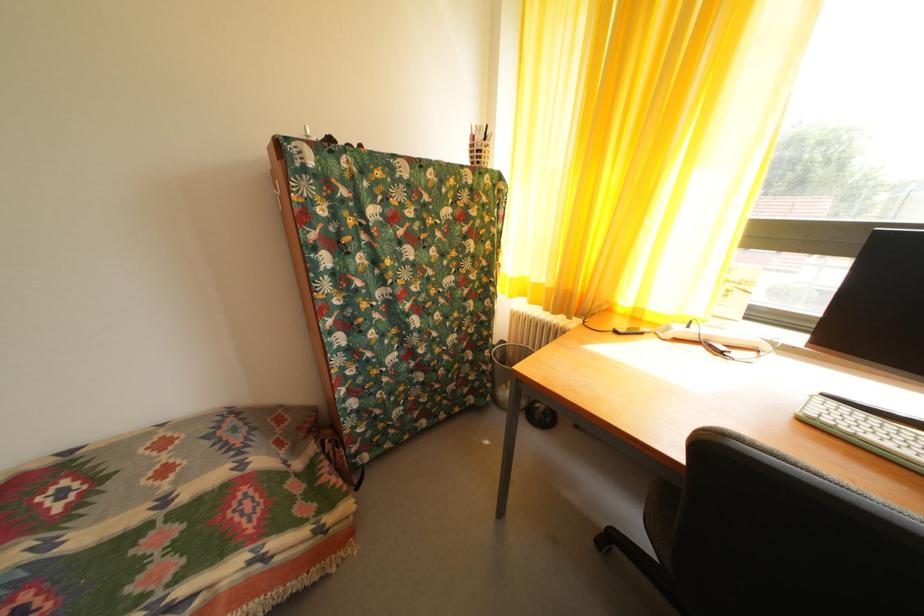
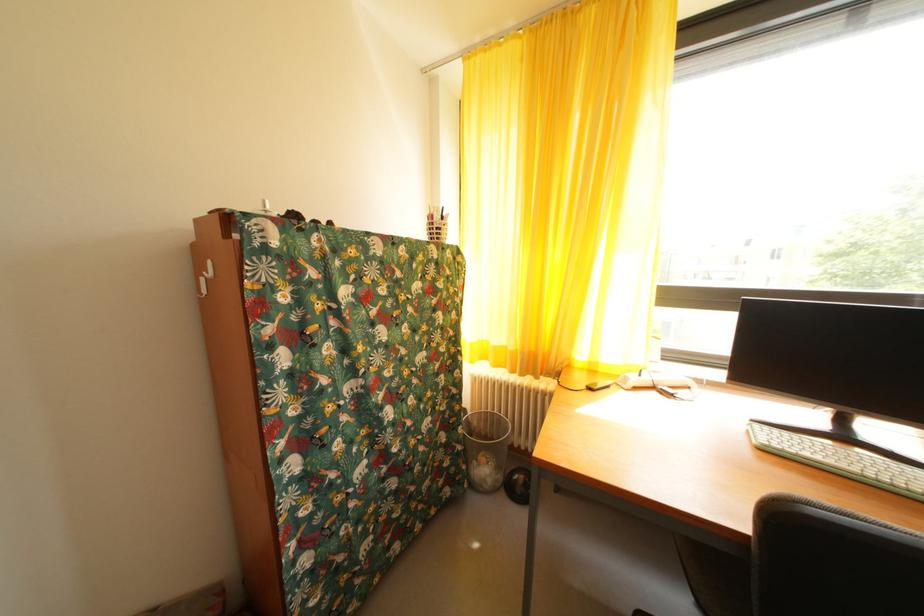
Where in the second image is the point corresponding to (493,373) from the first image?

(468, 454)